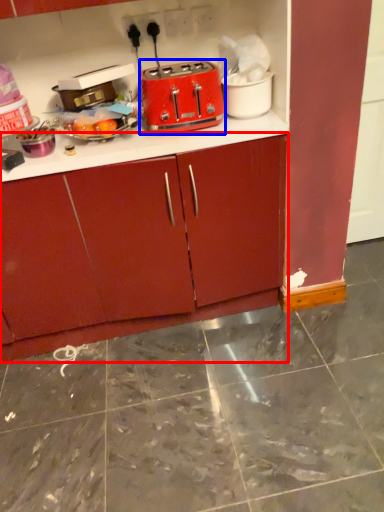
Question: Which object appears closest to the camera in this image, cabinetry (highlighted by a red box) or toaster (highlighted by a blue box)?

Choices:
 (A) cabinetry
 (B) toaster

Answer: (A)